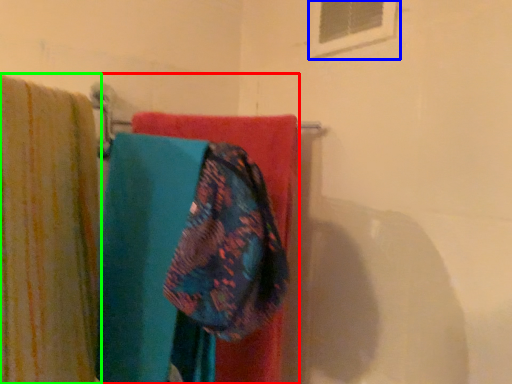
Question: Considering the real-world distances, which object is closest to laundry (highlighted by a red box)? window (highlighted by a blue box) or curtain (highlighted by a green box).

Choices:
 (A) window
 (B) curtain

Answer: (B)